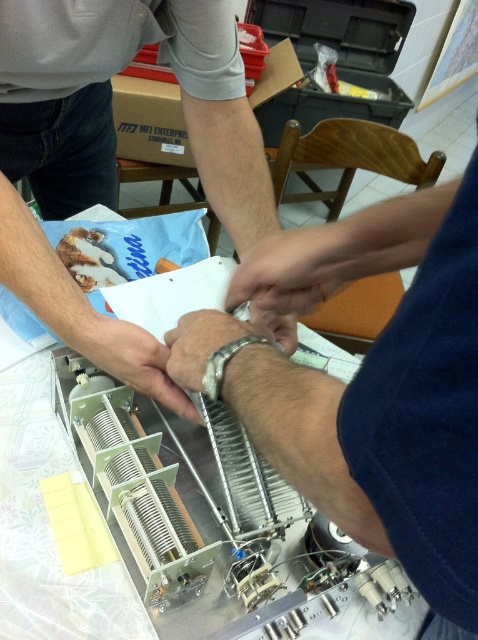
Question: Considering the real-world distances, which object is closest to the white matte hand at center?

Choices:
 (A) metallic silver wristwatch at center
 (B) silver metallic bracelet at center
 (C) sleek silver wristwatch at center

Answer: (B)

Question: Is metallic silver wristwatch at center thinner than sleek silver wristwatch at center?

Choices:
 (A) yes
 (B) no

Answer: (B)

Question: Which point is farther to the camera?

Choices:
 (A) silver metallic bracelet at center
 (B) white matte hand at center

Answer: (B)

Question: Considering the real-world distances, which object is farthest from the silver metallic bracelet at center?

Choices:
 (A) metallic silver wristwatch at center
 (B) white matte hand at center
 (C) sleek silver wristwatch at center

Answer: (B)

Question: Does white matte hand at center appear on the right side of sleek silver wristwatch at center?

Choices:
 (A) yes
 (B) no

Answer: (A)

Question: Is metallic silver wristwatch at center smaller than sleek silver wristwatch at center?

Choices:
 (A) yes
 (B) no

Answer: (B)